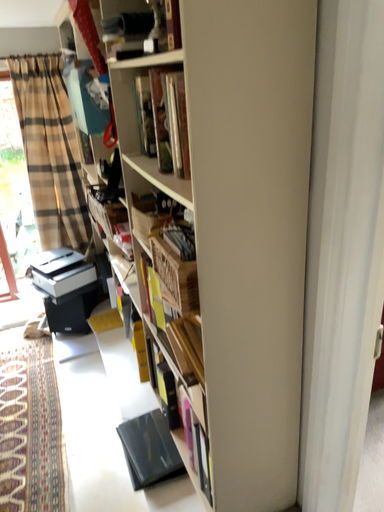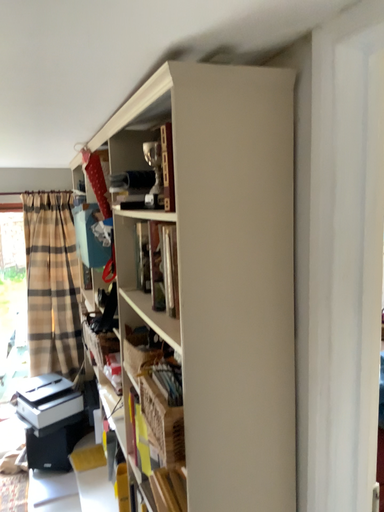
Question: How did the camera likely rotate when shooting the video?

Choices:
 (A) rotated downward
 (B) rotated upward

Answer: (B)